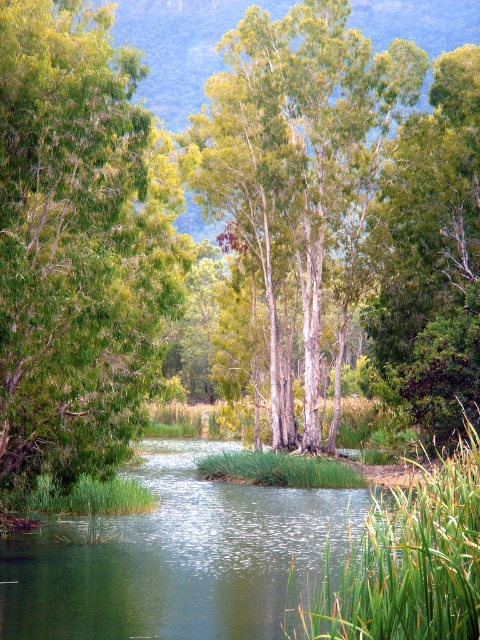
You are standing at the edge of the water and want to walk towards the green smooth tree at center. Which direction should you walk to avoid the green leafy tree at left?

To reach the green smooth tree at center while avoiding the green leafy tree at left, walk towards the right side, as the green leafy tree at left is positioned to the left of the green smooth tree at center.

You are standing at the point marked by point (79,243) in the image. Looking around, what is the closest object to you in the scene?

The closest object to you at point (79,243) is the green leafy tree at left, as it is represented by that coordinate point.